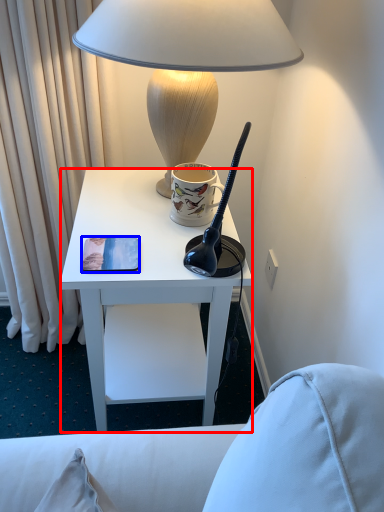
Question: Among these objects, which one is farthest to the camera, desk (highlighted by a red box) or pad (highlighted by a blue box)?

Choices:
 (A) desk
 (B) pad

Answer: (B)